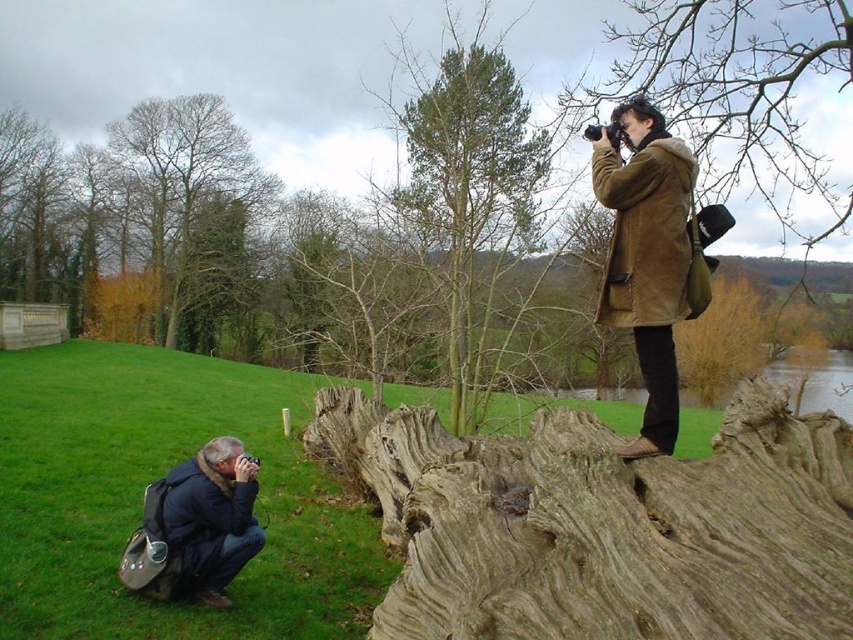
Question: Is weathered wood log at upper center thinner than brown suede coat at upper right?

Choices:
 (A) yes
 (B) no

Answer: (B)

Question: Which point appears farthest from the camera in this image?

Choices:
 (A) (683, 154)
 (B) (769, 65)

Answer: (B)

Question: Which point is closer to the camera taking this photo?

Choices:
 (A) (695, 12)
 (B) (206, 205)
 (C) (688, 168)

Answer: (C)

Question: Can you confirm if weathered wood log at upper center is smaller than brown textured coat at upper right?

Choices:
 (A) no
 (B) yes

Answer: (B)

Question: In this image, where is weathered wood log at upper center located relative to brown textured coat at upper right?

Choices:
 (A) below
 (B) above

Answer: (A)

Question: Among these objects, which one is farthest from the camera?

Choices:
 (A) brown suede coat at upper right
 (B) weathered wood log at upper center
 (C) brown textured tree trunk at upper left
 (D) brown textured coat at upper right

Answer: (C)